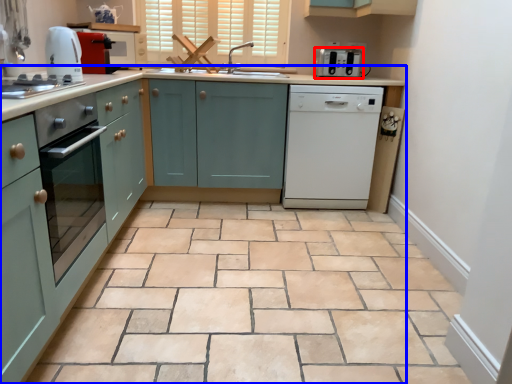
Question: Which object appears closest to the camera in this image, kitchen appliance (highlighted by a red box) or countertop (highlighted by a blue box)?

Choices:
 (A) kitchen appliance
 (B) countertop

Answer: (B)